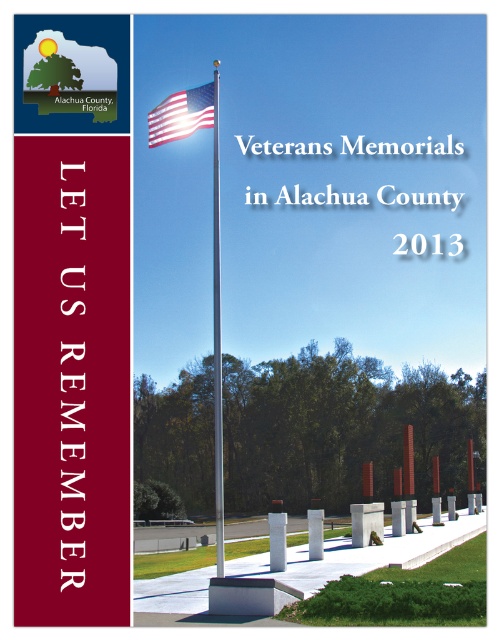
You are a photographer standing at the entrance of the memorial area. You want to take a photo that includes both the polished metal flag pole at center and the white concrete pillar at center. Which object should you position closer to the camera to ensure both are in focus?

To ensure both the polished metal flag pole at center and the white concrete pillar at center are in focus, you should position the polished metal flag pole at center closer to the camera since it is already closer to the viewer than the white concrete pillar at center. This way, the depth of field will cover both objects effectively.

From the picture: You are a photographer standing at the entrance of the memorial site. You want to capture a photo of the polished metal flag pole at center without the white concrete pillar at center appearing in the background. Is this possible given their current arrangement?

The polished metal flag pole at center is positioned over white concrete pillar at center, so it would be difficult to avoid the pillar appearing in the background unless you move to a different angle or position.